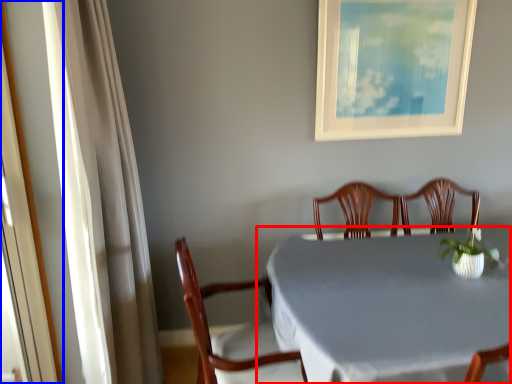
Question: Among these objects, which one is nearest to the camera, table (highlighted by a red box) or screen door (highlighted by a blue box)?

Choices:
 (A) table
 (B) screen door

Answer: (B)